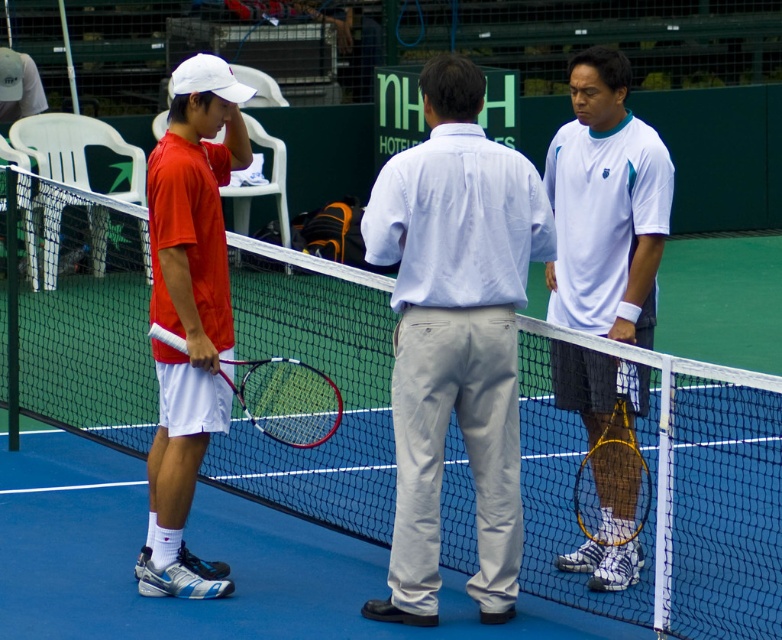
Is light blue cotton shirt at center thinner than wooden tennis racket at right?

No, light blue cotton shirt at center is not thinner than wooden tennis racket at right.

Is light blue cotton shirt at center to the right of wooden tennis racket at right from the viewer's perspective?

Incorrect, light blue cotton shirt at center is not on the right side of wooden tennis racket at right.

Does point (472, 166) come farther from viewer compared to point (579, 404)?

No, (472, 166) is in front of (579, 404).

The width and height of the screenshot is (782, 640). Identify the location of light blue cotton shirt at center. (454, 336).

Which of these two, matte red shirt at left or matte black tennis racket at left, stands taller?

matte red shirt at left is taller.

Is matte red shirt at left above matte black tennis racket at left?

Yes, matte red shirt at left is above matte black tennis racket at left.

Is point (213, 180) in front of point (339, 401)?

No, it is behind (339, 401).

Image resolution: width=782 pixels, height=640 pixels. Identify the location of matte red shirt at left. (189, 312).

Which is below, matte red shirt at left or wooden tennis racket at right?

wooden tennis racket at right is lower down.

Can you confirm if matte red shirt at left is positioned to the left of wooden tennis racket at right?

Indeed, matte red shirt at left is positioned on the left side of wooden tennis racket at right.

Find the location of a particular element. matte red shirt at left is located at coordinates (189, 312).

The height and width of the screenshot is (640, 782). Find the location of `matte red shirt at left`. matte red shirt at left is located at coordinates (189, 312).